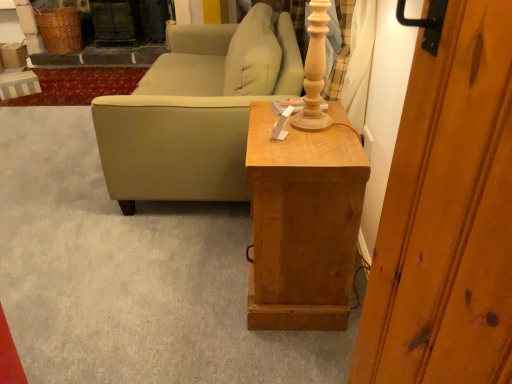
Where is `free location in front of wooden side table at center`? This screenshot has height=384, width=512. free location in front of wooden side table at center is located at coordinates (274, 348).